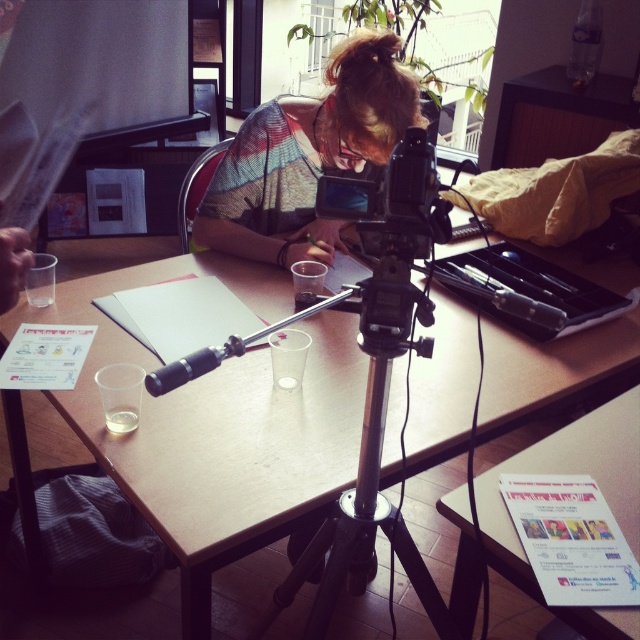
Question: From the image, what is the correct spatial relationship of silver metallic tripod at center in relation to black plastic camera at center?

Choices:
 (A) above
 (B) below

Answer: (B)

Question: Which point is farther to the camera?

Choices:
 (A) (540, 456)
 (B) (276, 188)

Answer: (B)

Question: Is knitted sweater at center thinner than silver metallic tripod at center?

Choices:
 (A) no
 (B) yes

Answer: (A)

Question: Is wooden table at center positioned at the back of silver metallic tripod at center?

Choices:
 (A) no
 (B) yes

Answer: (B)

Question: Which object is positioned farthest from the white paper at lower right?

Choices:
 (A) silver metallic tripod at center
 (B) black plastic camera at center
 (C) wooden table at center

Answer: (B)

Question: Which of the following is the closest to the observer?

Choices:
 (A) black plastic camera at center
 (B) knitted sweater at center
 (C) white paper at lower right
 (D) silver metallic tripod at center

Answer: (A)